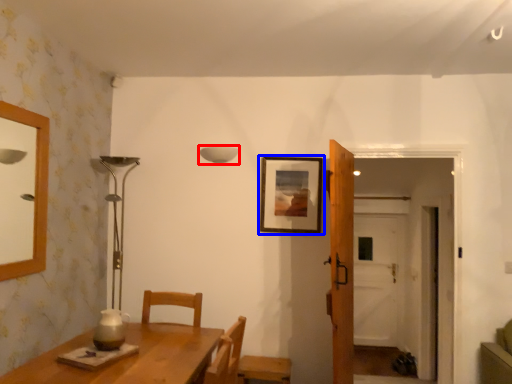
Question: Among these objects, which one is nearest to the camera, lamp (highlighted by a red box) or picture frame (highlighted by a blue box)?

Choices:
 (A) lamp
 (B) picture frame

Answer: (B)